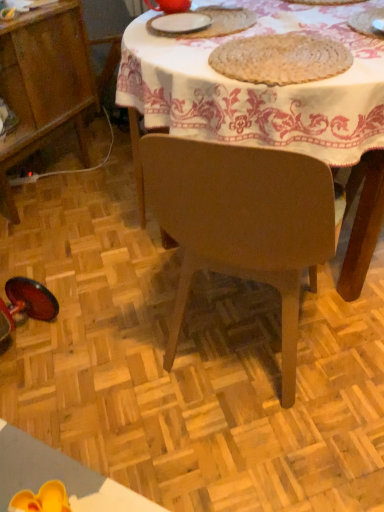
Question: In the image, is wooden cabinet at lower left on the left side or the right side of matte red teapot at upper center, the 3th tableware in the right-to-left sequence?

Choices:
 (A) right
 (B) left

Answer: (B)

Question: From a real-world perspective, relative to matte red teapot at upper center, the 3th tableware in the right-to-left sequence, is wooden cabinet at lower left vertically above or below?

Choices:
 (A) above
 (B) below

Answer: (B)

Question: Which object is the closest to the brown woven placemat at upper center?

Choices:
 (A) white woven placemat at upper right, which ranks as the 1th tableware in right-to-left order
 (B) wooden table at center
 (C) matte red teapot at upper center, the 3th tableware in the right-to-left sequence
 (D) wooden cabinet at lower left
 (E) white matte plate at upper center, marked as the 2th tableware in a right-to-left arrangement

Answer: (B)

Question: Based on their relative distances, which object is nearer to the matte red teapot at upper center, arranged as the 1th tableware when viewed from the left?

Choices:
 (A) brown woven placemat at upper center
 (B) white woven placemat at upper right, which appears as the 3th tableware when viewed from the left
 (C) wooden cabinet at lower left
 (D) wooden table at center
 (E) white matte plate at upper center, marked as the 2th tableware in a right-to-left arrangement

Answer: (E)